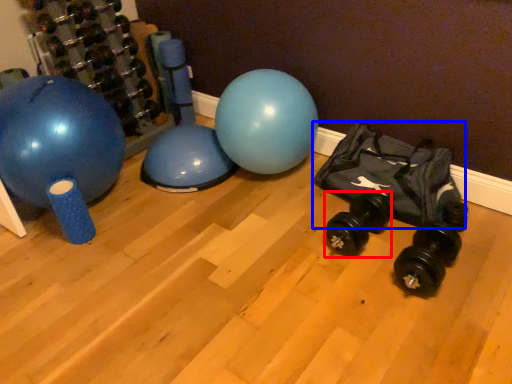
Question: Which point is closer to the camera, dumbbell (highlighted by a red box) or bean bag chair (highlighted by a blue box)?

Choices:
 (A) dumbbell
 (B) bean bag chair

Answer: (B)